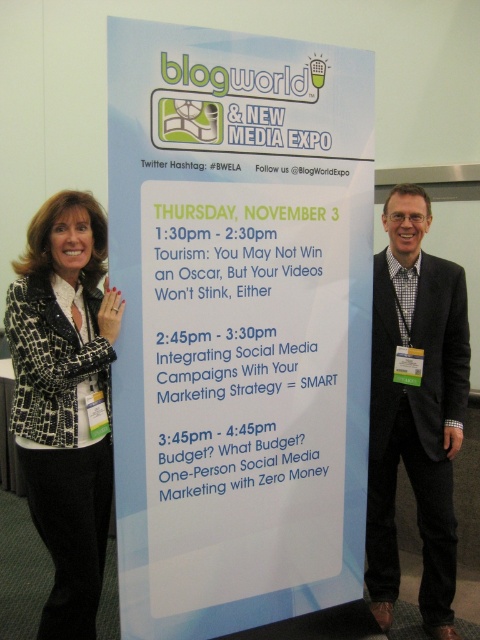
Which is above, leopard print blazer at left or black suit at right?

leopard print blazer at left

The height and width of the screenshot is (640, 480). What do you see at coordinates (66, 400) in the screenshot? I see `leopard print blazer at left` at bounding box center [66, 400].

The image size is (480, 640). Identify the location of leopard print blazer at left. (66, 400).

Is point (176, 412) farther from camera compared to point (434, 336)?

No, it is in front of (434, 336).

Who is more distant from viewer, (133, 205) or (446, 605)?

The point (446, 605) is behind.

At what (x,y) coordinates should I click in order to perform the action: click on white paperboard sign at center. Please return your answer as a coordinate pair (x, y). Image resolution: width=480 pixels, height=640 pixels. Looking at the image, I should click on (238, 324).

Can you confirm if white paperboard sign at center is positioned above leopard print blazer at left?

Yes.

Which of these two, white paperboard sign at center or leopard print blazer at left, stands shorter?

leopard print blazer at left

Is point (216, 84) positioned after point (74, 509)?

That is False.

The height and width of the screenshot is (640, 480). I want to click on white paperboard sign at center, so click(x=238, y=324).